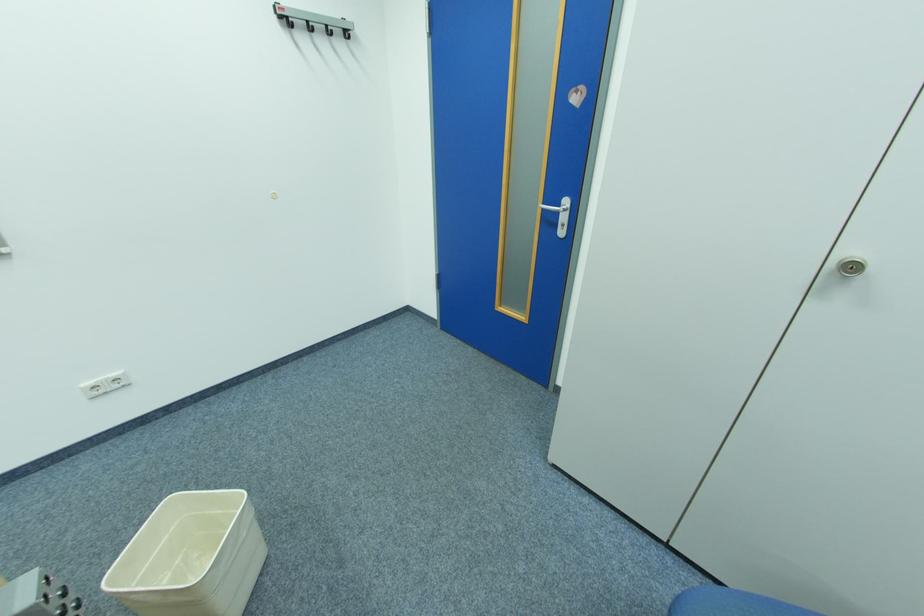
Image resolution: width=924 pixels, height=616 pixels. In order to click on silver cabinet lock in this screenshot , I will do `click(312, 20)`.